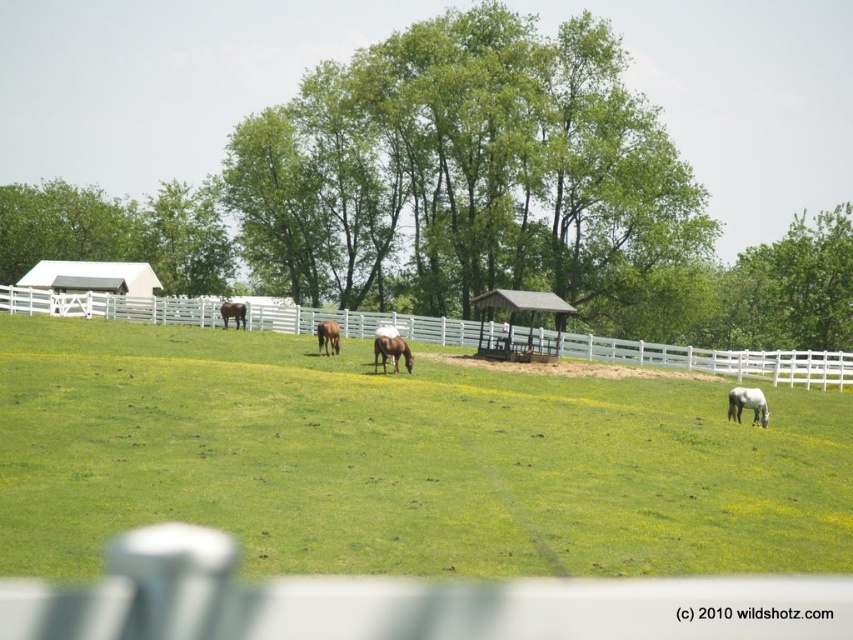
From the picture: You are standing in the middle of the field and want to walk towards the point marked as point (x=399, y=348). Which direction should you go relative to the point marked as point (x=329, y=324)?

Since point (x=399, y=348) is in front of point (x=329, y=324), you should walk towards the direction of point (x=399, y=348) which is in front of point (x=329, y=324).

Consider the image. You are a farmer standing at the white wooden fence at center. You want to throw a carrot to the white horse on the left. Can you reach it?

The distance between the white wooden fence at center and the white horse on the left is 46.45 meters, so you cannot reach it by throwing a carrot that far.

You are a photographer trying to capture a photo of the brown glossy horse at center without the white wooden fence at center blocking the view. Based on their sizes, which one should you move closer to in order to frame the horse without the fence in the shot?

The white wooden fence at center is larger in size than the brown glossy horse at center, so to avoid the fence blocking the view, you should move closer to the brown glossy horse at center. This will make the horse take up more of the frame while reducing the fence size in the background.